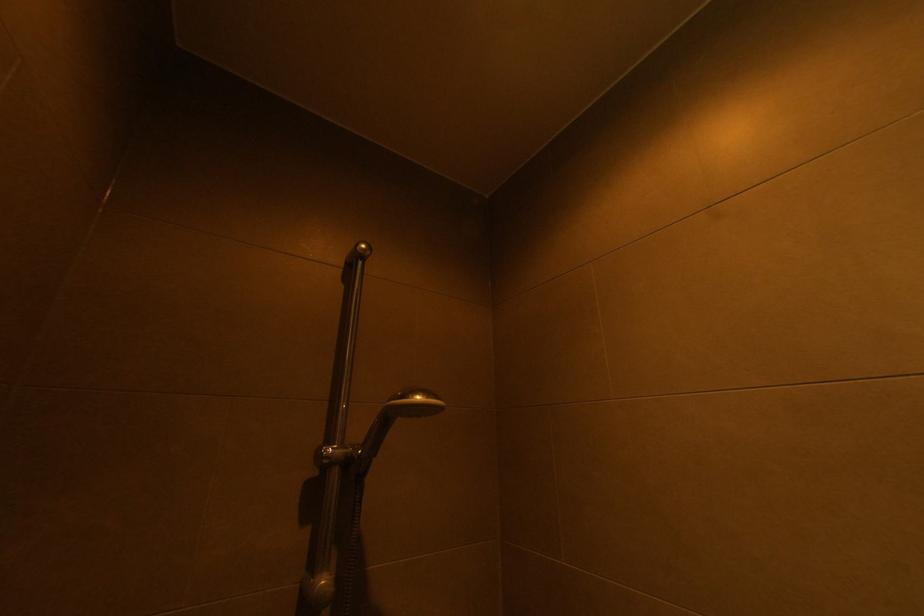
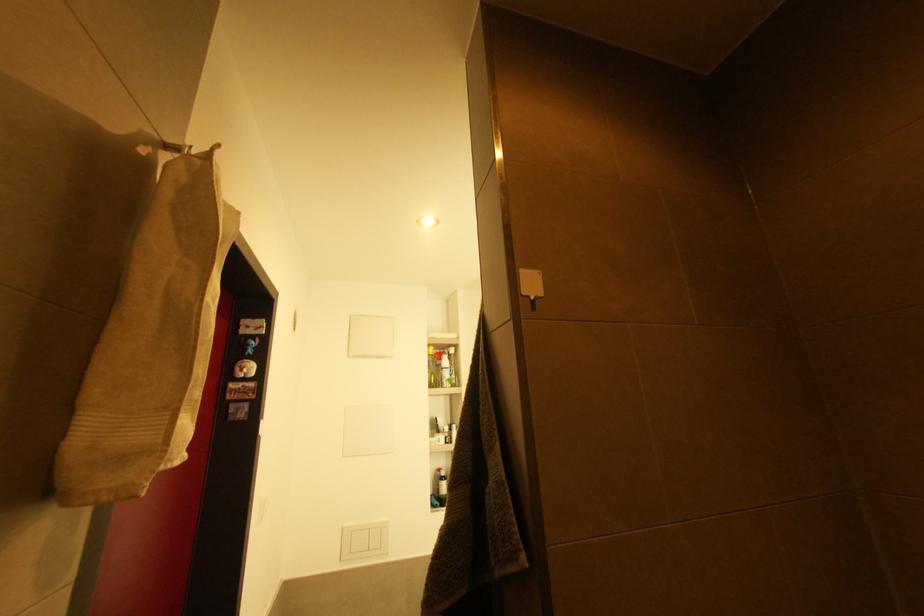
The images are taken continuously from a first-person perspective. In which direction is your viewpoint rotating?

The camera's rotation is toward left-up.